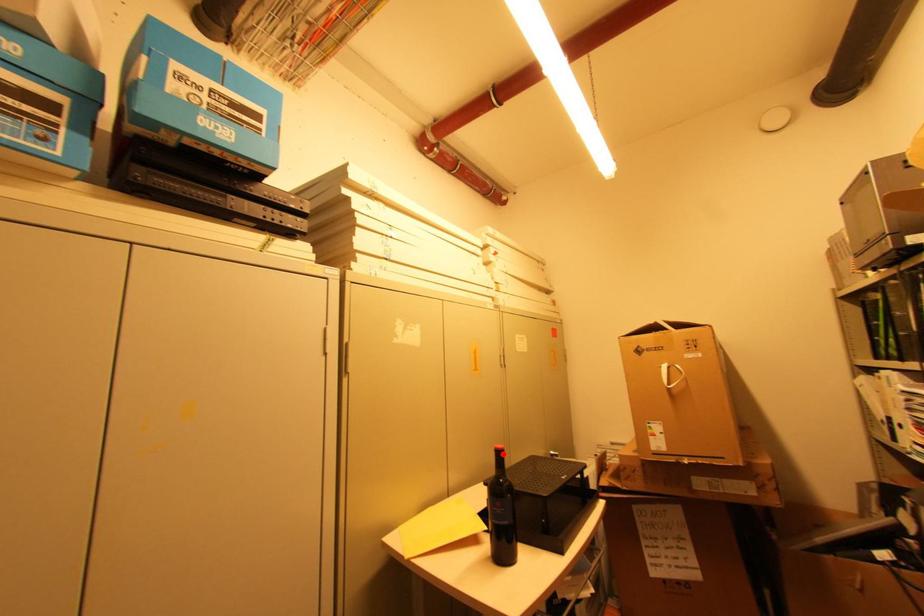
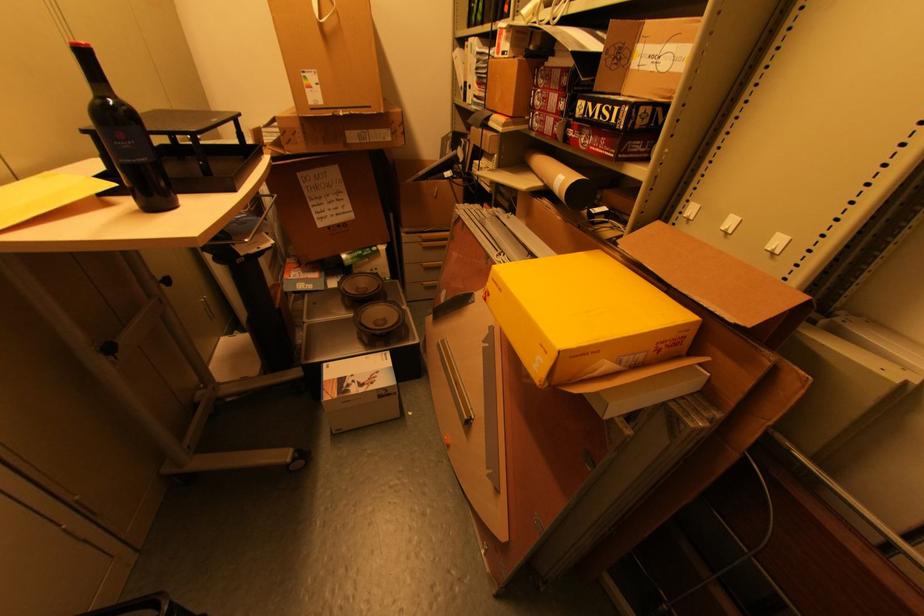
Where in the second image is the point corresponding to the highlighted location from the first image?

(89, 55)